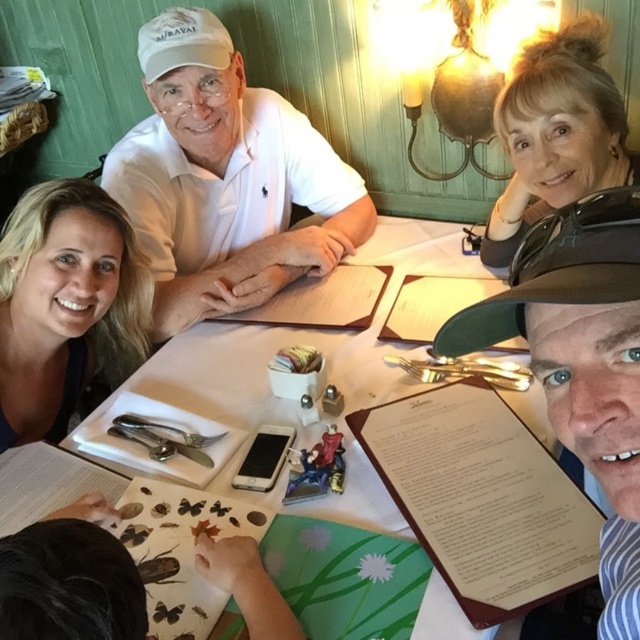
Which is more to the left, brown leather hat at upper right or blonde hair at left?

blonde hair at left

Which is below, brown leather hat at upper right or blonde hair at left?

Positioned lower is brown leather hat at upper right.

At what (x,y) coordinates should I click in order to perform the action: click on brown leather hat at upper right. Please return your answer as a coordinate pair (x, y). Image resolution: width=640 pixels, height=640 pixels. Looking at the image, I should click on (580, 360).

Between brown leather hat at upper right and white paper placemat at center, which one has less height?

brown leather hat at upper right

Is the position of brown leather hat at upper right less distant than that of white paper placemat at center?

Yes, it is in front of white paper placemat at center.

Which is behind, point (573, 392) or point (388, 522)?

Point (388, 522)

This screenshot has height=640, width=640. I want to click on brown leather hat at upper right, so click(580, 360).

Does white paper placemat at center have a larger size compared to blonde hair at left?

Yes.

Who is more distant from viewer, (240,381) or (58,186)?

Positioned behind is point (240,381).

Image resolution: width=640 pixels, height=640 pixels. What are the coordinates of `white paper placemat at center` in the screenshot? It's located at (292, 342).